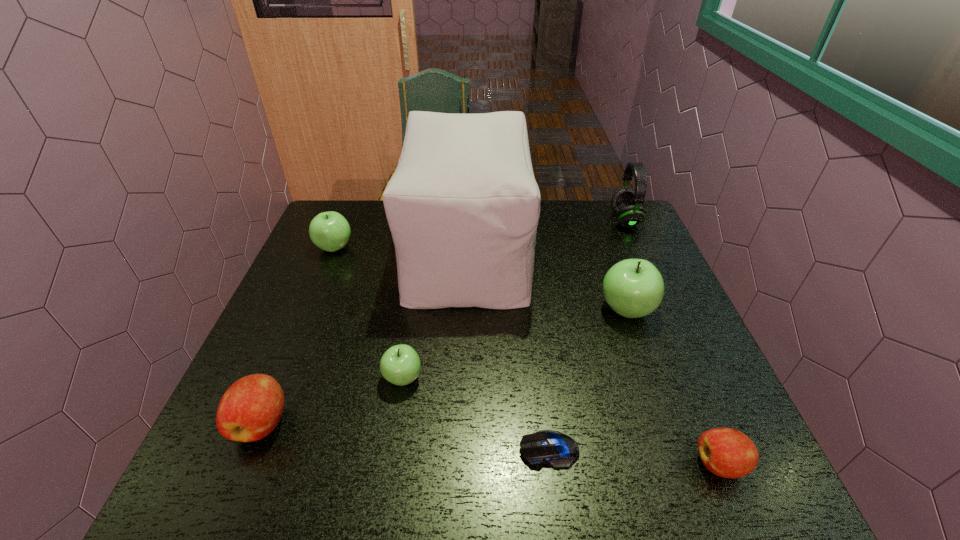
Locate which apple ranks third in proximity to the shortest object. Please provide its 2D coordinates. Your answer should be formatted as a tuple, i.e. [(x, y)], where the tuple contains the x and y coordinates of a point satisfying the conditions above.

[(633, 288)]

Locate an element on the screen. This screenshot has width=960, height=540. apple identified as the second closest to the computer mouse is located at coordinates (400, 365).

You are a GUI agent. You are given a task and a screenshot of the screen. Output one action in this format:
    pyautogui.click(x=<x>, y=<y>)
    Task: Click on the green apple that is the closest to the biggest green apple
    This screenshot has width=960, height=540.
    Given the screenshot: What is the action you would take?
    pyautogui.click(x=400, y=365)

I want to click on the second closest green apple relative to the third apple from right to left, so click(633, 288).

Locate an element on the screen. Image resolution: width=960 pixels, height=540 pixels. free space that satisfies the following two spatial constraints: 1. on the button side of the computer mouse; 2. on the right side of the smaller red apple is located at coordinates [x=551, y=464].

Where is `vacant area in the image that satisfies the following two spatial constraints: 1. on the back side of the bigger red apple; 2. on the right side of the third tallest object`? This screenshot has height=540, width=960. vacant area in the image that satisfies the following two spatial constraints: 1. on the back side of the bigger red apple; 2. on the right side of the third tallest object is located at coordinates (308, 310).

Where is `free region that satisfies the following two spatial constraints: 1. on the ear cups of the second tallest object; 2. on the front side of the right red apple`? free region that satisfies the following two spatial constraints: 1. on the ear cups of the second tallest object; 2. on the front side of the right red apple is located at coordinates (733, 464).

I want to click on vacant area in the image that satisfies the following two spatial constraints: 1. on the side of the tallest object with the smiley face; 2. on the right side of the smaller red apple, so click(460, 464).